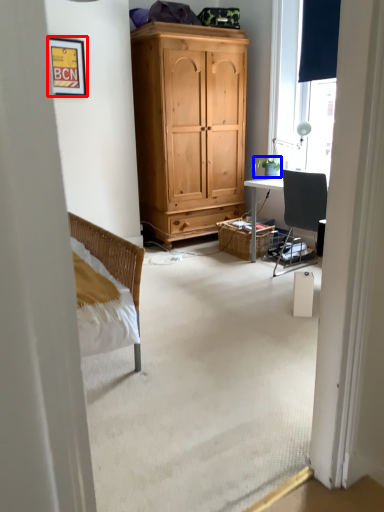
Question: Which point is closer to the camera, picture frame (highlighted by a red box) or houseplant (highlighted by a blue box)?

Choices:
 (A) picture frame
 (B) houseplant

Answer: (A)